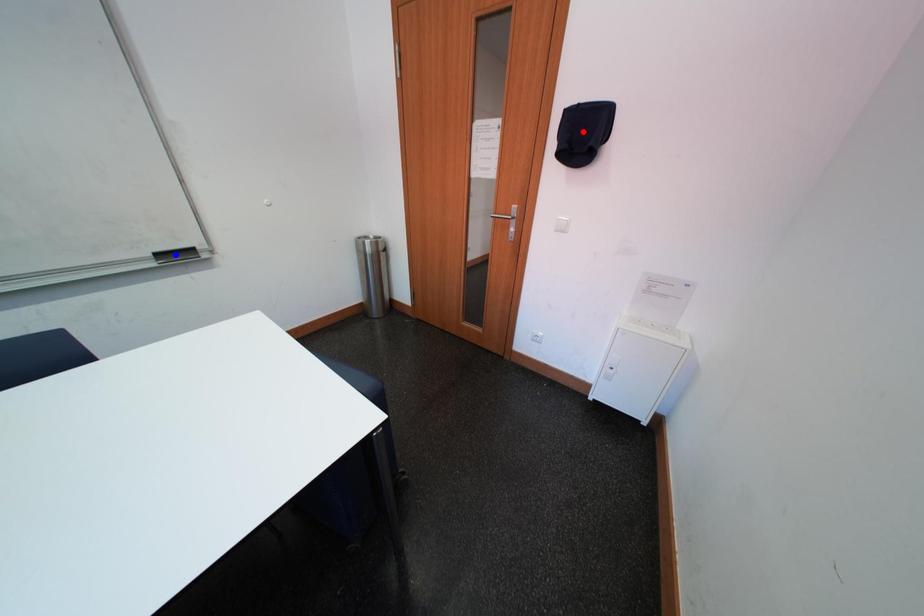
Question: Two points are marked on the image. Which point is closer to the camera?

Choices:
 (A) Blue point is closer.
 (B) Red point is closer.

Answer: (B)